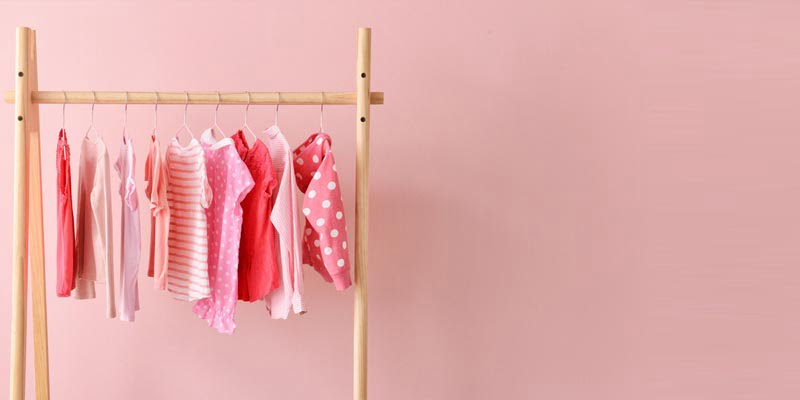
At what (x,y) coordinates should I click in order to perform the action: click on hangers. Please return your answer as a coordinate pair (x, y). The height and width of the screenshot is (400, 800). Looking at the image, I should click on (322, 123), (276, 119), (246, 119), (217, 119), (182, 125), (156, 125), (94, 127), (66, 122).